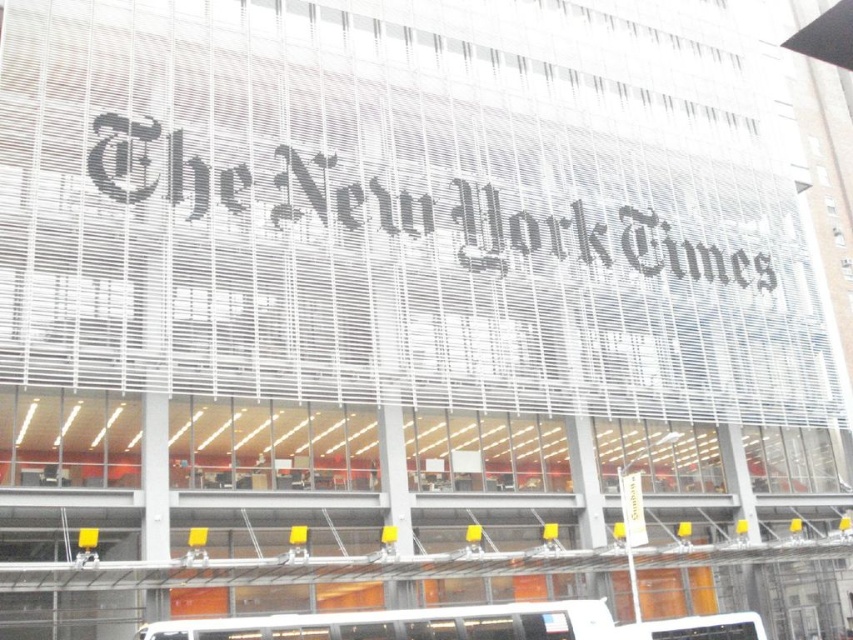
You are a visitor holding a black paper at center and want to take a photo of the white matte tour bus at lower center. Can you see the tour bus through the black paper?

The black paper at center is above the white matte tour bus at lower center, so you cannot see the tour bus through the black paper as it is blocked by the black paper.

You are a delivery person who needs to place a small package on the black paper at center and the white matte tour bus at lower center. Since both locations are visible from the street, which one can you place the package on without it being hidden by the other?

The black paper at center is larger in size than the white matte tour bus at lower center, so placing the package on the black paper at center would ensure it is not hidden by the smaller white matte tour bus at lower center.